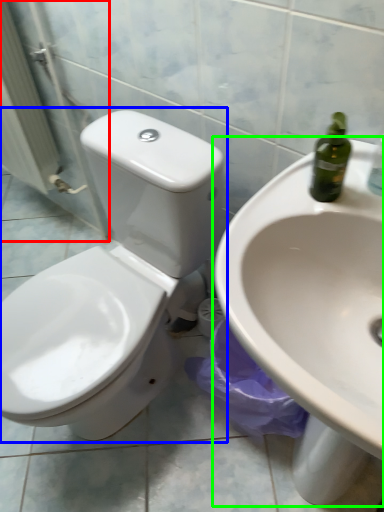
Question: Considering the real-world distances, which object is farthest from screen door (highlighted by a red box)? toilet (highlighted by a blue box) or sink (highlighted by a green box)?

Choices:
 (A) toilet
 (B) sink

Answer: (B)